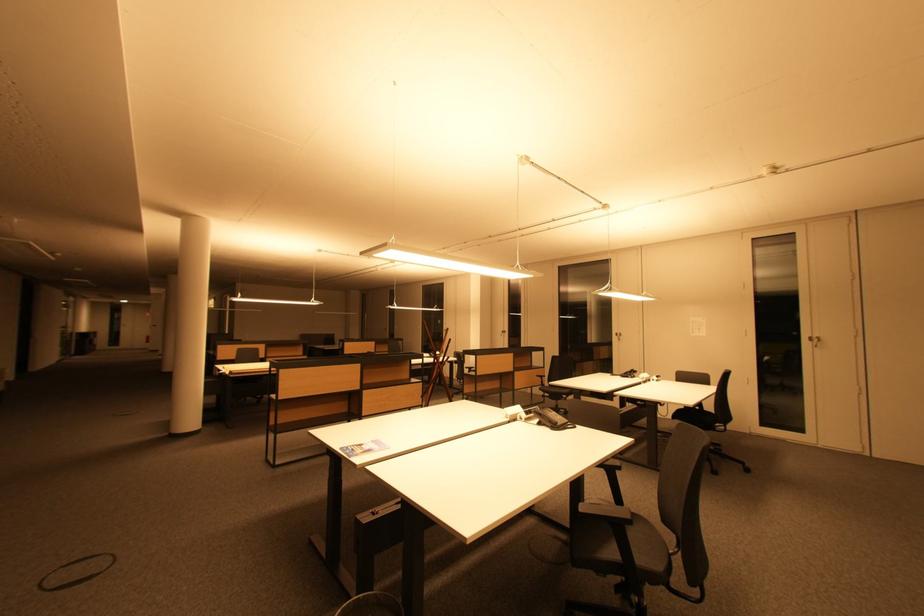
Identify the location of chair sitting surface. (696, 416).